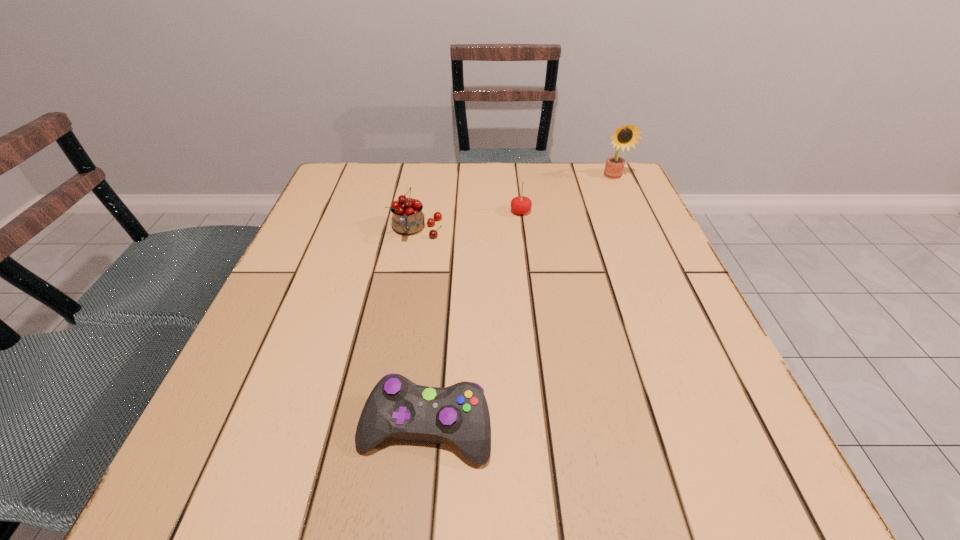
The width and height of the screenshot is (960, 540). In order to click on sunflower in this screenshot , I will do `click(626, 136)`.

Where is `the rightmost object`? This screenshot has height=540, width=960. the rightmost object is located at coordinates (626, 136).

What are the coordinates of `the taller cherry` in the screenshot? It's located at (407, 217).

Image resolution: width=960 pixels, height=540 pixels. What are the coordinates of `the left cherry` in the screenshot? It's located at (407, 217).

This screenshot has width=960, height=540. In order to click on the shorter cherry in this screenshot , I will do `click(521, 205)`.

Identify the location of the right cherry. (521, 205).

This screenshot has height=540, width=960. I want to click on control, so click(396, 407).

What are the coordinates of `the shortest object` in the screenshot? It's located at (x=396, y=407).

Where is `vacant space located 0.400m on the face of the rightmost object`? vacant space located 0.400m on the face of the rightmost object is located at coordinates (661, 284).

At what (x,y) coordinates should I click in order to perform the action: click on vacant space located on the handle side of the taller cherry. Please return your answer as a coordinate pair (x, y). The image size is (960, 540). Looking at the image, I should click on (407, 285).